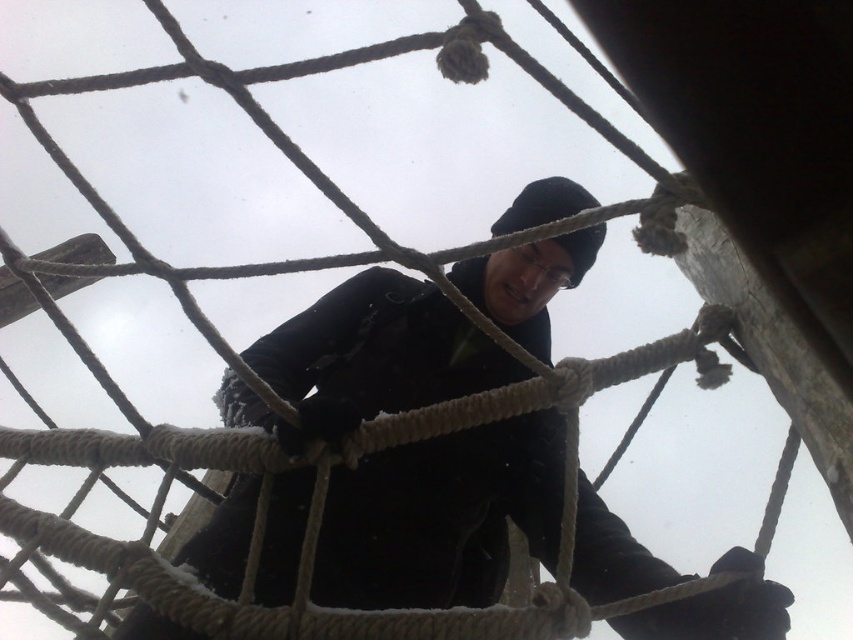
Question: Does black matte jacket at center have a larger size compared to black woolen hat at upper center?

Choices:
 (A) yes
 (B) no

Answer: (A)

Question: Can you confirm if black matte jacket at center is positioned above black woolen hat at upper center?

Choices:
 (A) yes
 (B) no

Answer: (B)

Question: Can you confirm if black matte jacket at center is positioned below black woolen hat at upper center?

Choices:
 (A) yes
 (B) no

Answer: (A)